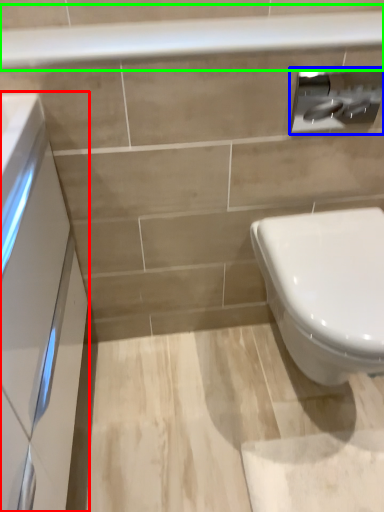
Question: Estimate the real-world distances between objects in this image. Which object is farther from porcelain (highlighted by a red box), toilet paper (highlighted by a blue box) or balustrade (highlighted by a green box)?

Choices:
 (A) toilet paper
 (B) balustrade

Answer: (A)